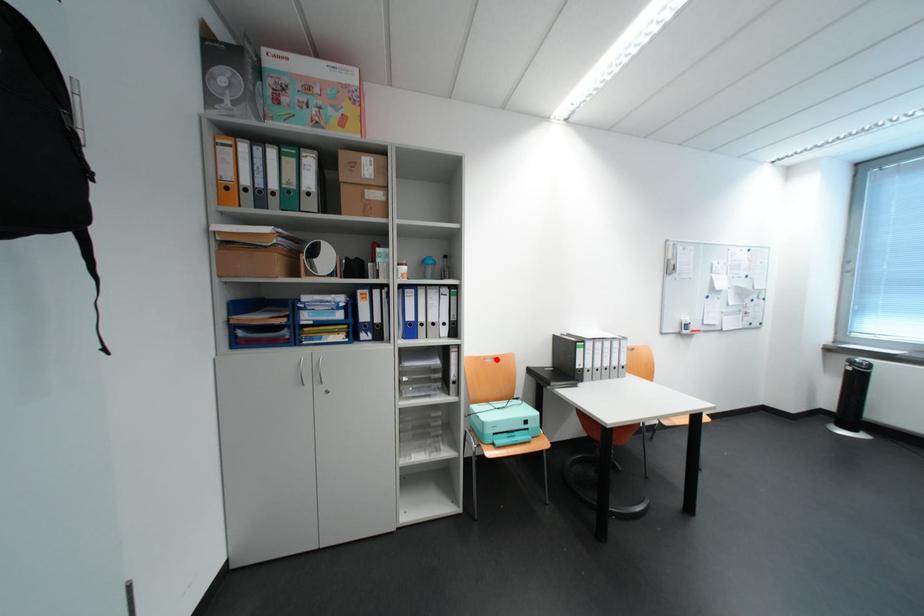
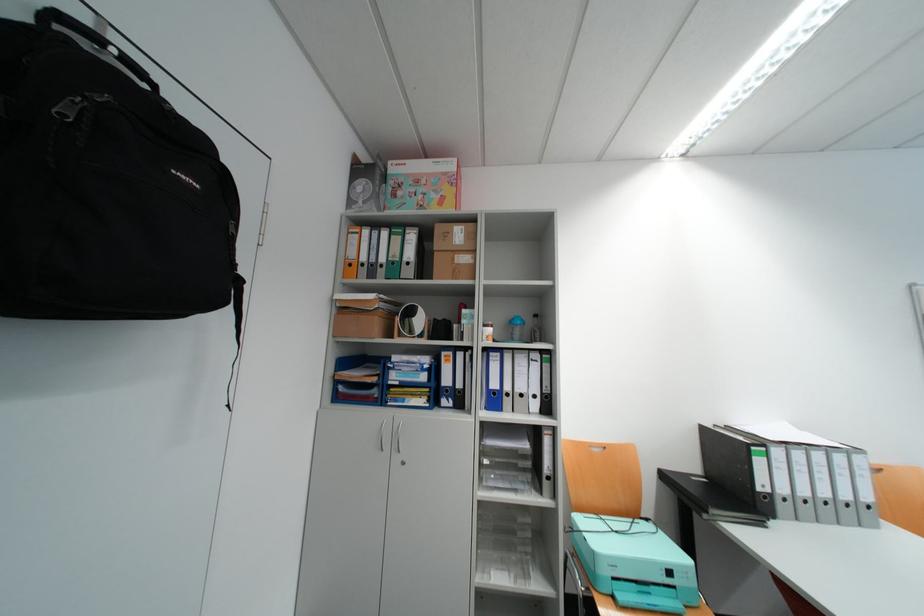
Question: I am providing you with two images of the same scene from different viewpoints. Given a red point in image1, look at the same physical point in image2. Is it:

Choices:
 (A) Closer to the viewpoint
 (B) Farther from the viewpoint

Answer: (B)